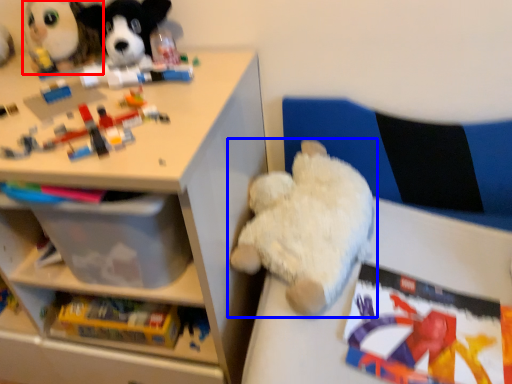
Question: Among these objects, which one is farthest to the camera, toy (highlighted by a red box) or toy (highlighted by a blue box)?

Choices:
 (A) toy
 (B) toy

Answer: (A)